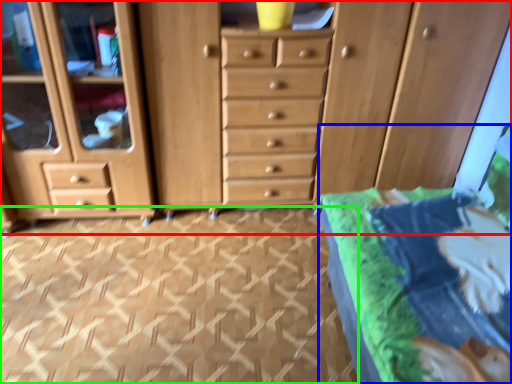
Question: Which is farther away from chest of drawers (highlighted by a red box)? bed (highlighted by a blue box) or tile (highlighted by a green box)?

Choices:
 (A) bed
 (B) tile

Answer: (A)